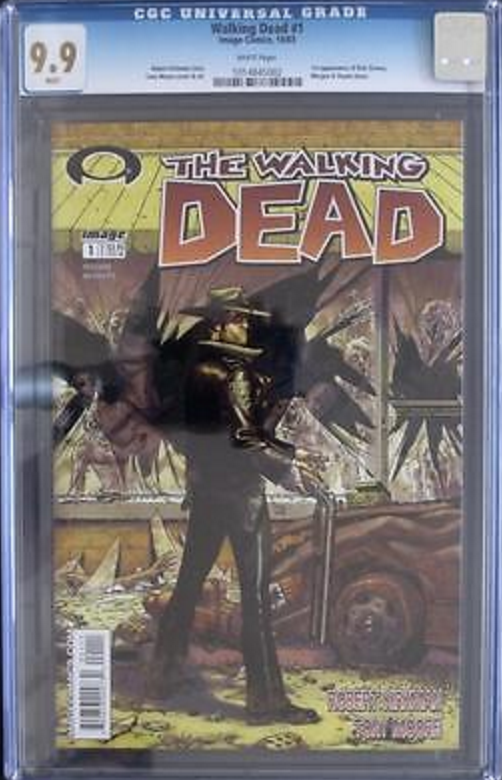
The image size is (502, 780). Identify the location of broken window. (311, 364), (421, 374), (441, 444), (107, 388).